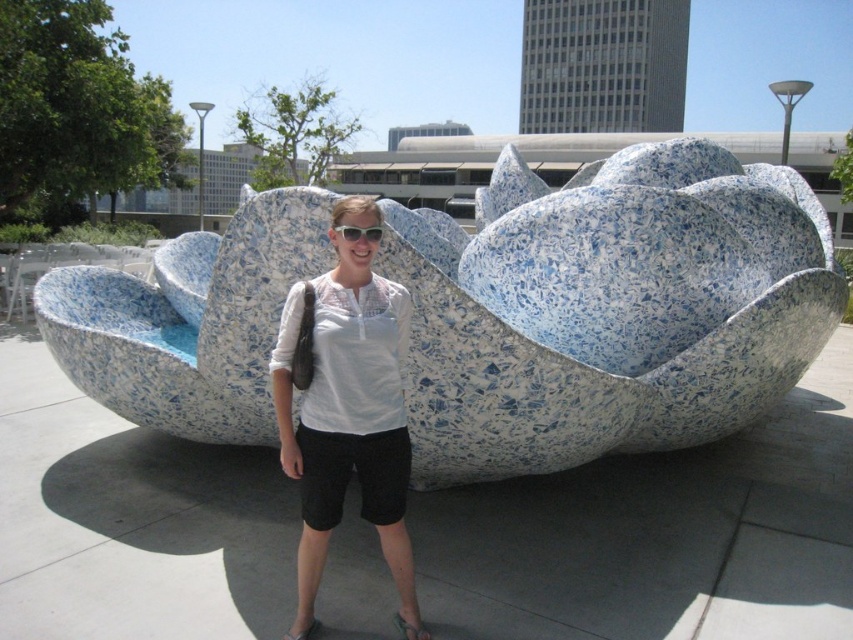
You are standing in front of the sculpture and want to take a photo that includes both you and the blue speckled stone flower at center. If you are currently 2.93 meters away from the flower, what is the minimum distance you should move backward to ensure you and the flower are fully visible in the frame?

Since the blue speckled stone flower at center is 2.93 meters away from the viewer, moving backward by at least 0.5 meters would ensure both you and the flower are fully visible in the photo.

You are a photographer trying to capture the blue speckled stone flower at center and the white plastic sunglasses at center in a single shot. Based on their positions, which object should you adjust your camera to focus on first if you want to ensure both are in frame?

The blue speckled stone flower at center is positioned on the right side of white plastic sunglasses at center. To ensure both are in frame, focus on the white plastic sunglasses at center first as it is closer to the left, then adjust the camera to include the blue speckled stone flower at center on the right.

You are a photographer trying to capture the sculpture in the center. You notice a specific point marked at coordinates point (608, 308). Where exactly is this point located on the sculpture?

The point (608, 308) is on the blue speckled stone flower at center.